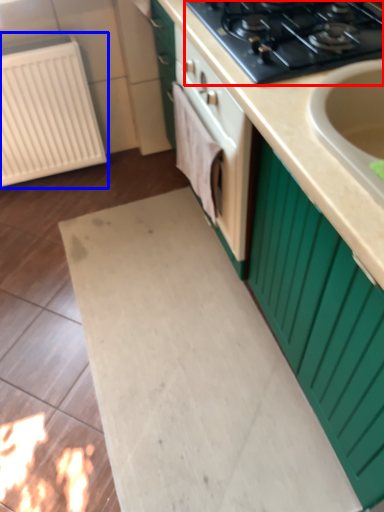
Question: Which of the following is the farthest to the observer, gas stove (highlighted by a red box) or radiator (highlighted by a blue box)?

Choices:
 (A) gas stove
 (B) radiator

Answer: (B)